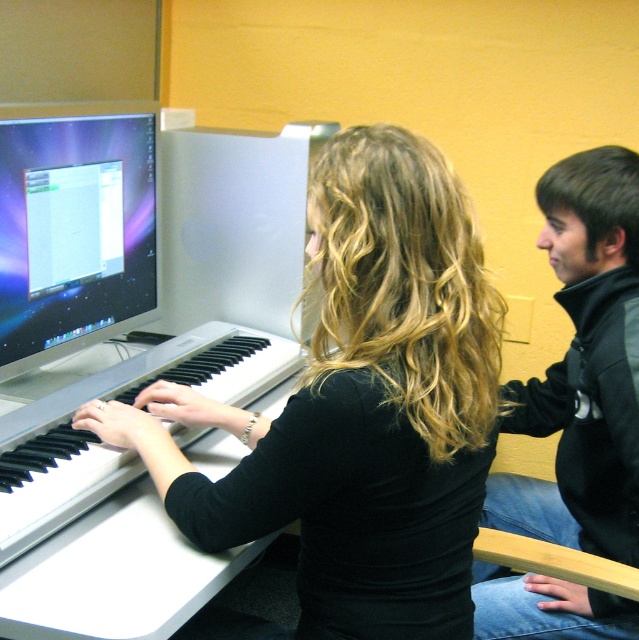
Does black fleece jacket at upper right have a lesser width compared to black plastic piano at center?

Yes, black fleece jacket at upper right is thinner than black plastic piano at center.

This screenshot has width=639, height=640. Find the location of `black fleece jacket at upper right`. black fleece jacket at upper right is located at coordinates (x=583, y=368).

Between point (610, 545) and point (12, 433), which one is positioned in front?

Positioned in front is point (12, 433).

Find the location of a particular element. The image size is (639, 640). black fleece jacket at upper right is located at coordinates pyautogui.click(x=583, y=368).

Is black matte keyboard at center thinner than shiny silver monitor at left?

In fact, black matte keyboard at center might be wider than shiny silver monitor at left.

Is black matte keyboard at center below shiny silver monitor at left?

Yes, black matte keyboard at center is below shiny silver monitor at left.

This screenshot has width=639, height=640. What do you see at coordinates (358, 404) in the screenshot?
I see `black matte keyboard at center` at bounding box center [358, 404].

You are a GUI agent. You are given a task and a screenshot of the screen. Output one action in this format:
    pyautogui.click(x=<x>, y=<y>)
    Task: Click on the black matte keyboard at center
    
    Given the screenshot: What is the action you would take?
    pyautogui.click(x=358, y=404)

Which is more to the left, black matte keyboard at center or black fleece jacket at upper right?

black matte keyboard at center

Is black matte keyboard at center further to the viewer compared to black fleece jacket at upper right?

No, it is not.

Does point (380, 125) come farther from viewer compared to point (558, 609)?

That is False.

Find the location of `black matte keyboard at center`. black matte keyboard at center is located at coordinates (358, 404).